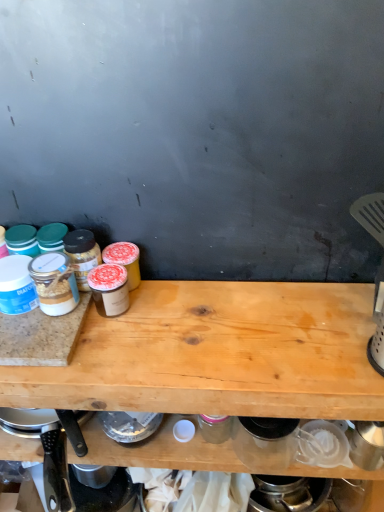
Find the location of `vacant area that is situated to the right of granite cutting board at left`. vacant area that is situated to the right of granite cutting board at left is located at coordinates (138, 333).